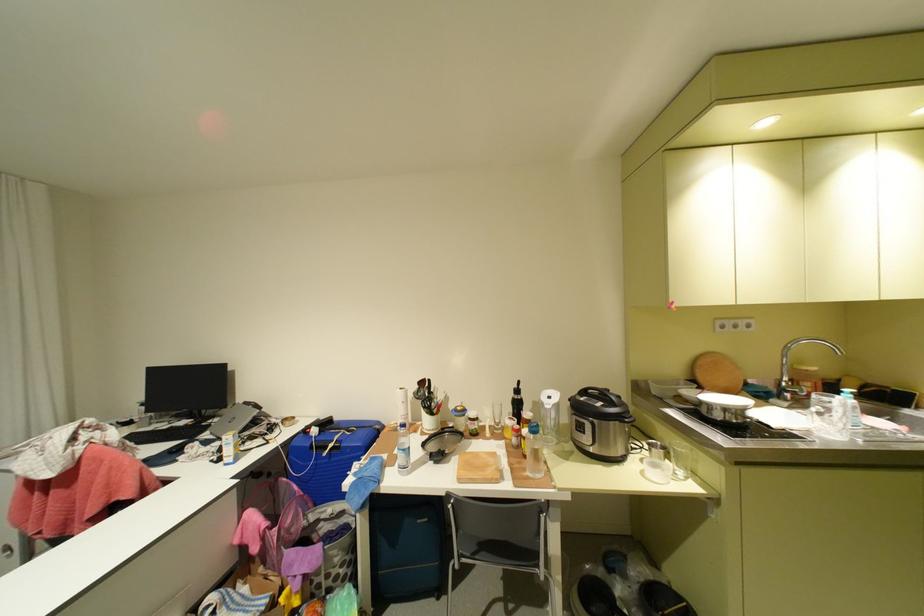
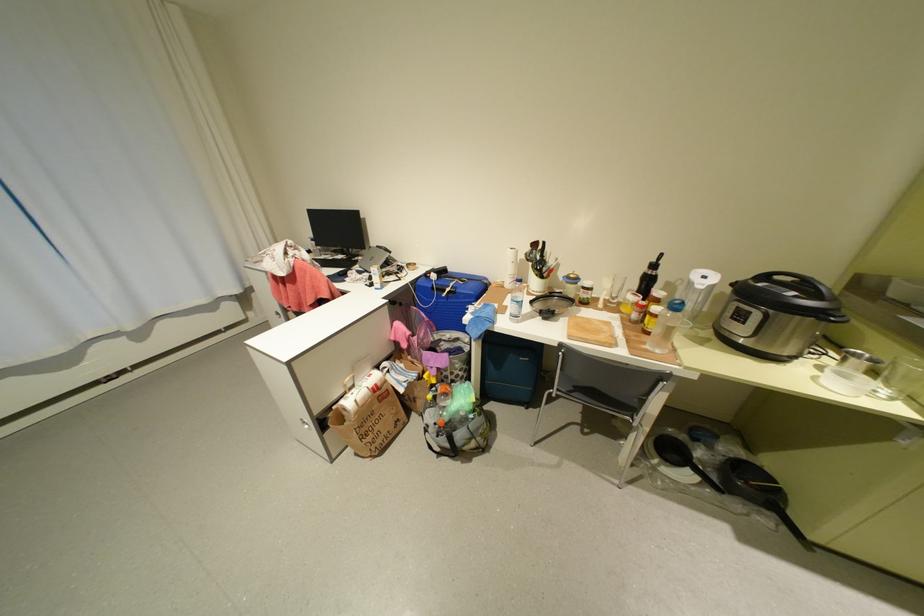
The point at (691, 474) is marked in the first image. Where is the corresponding point in the second image?

(897, 392)